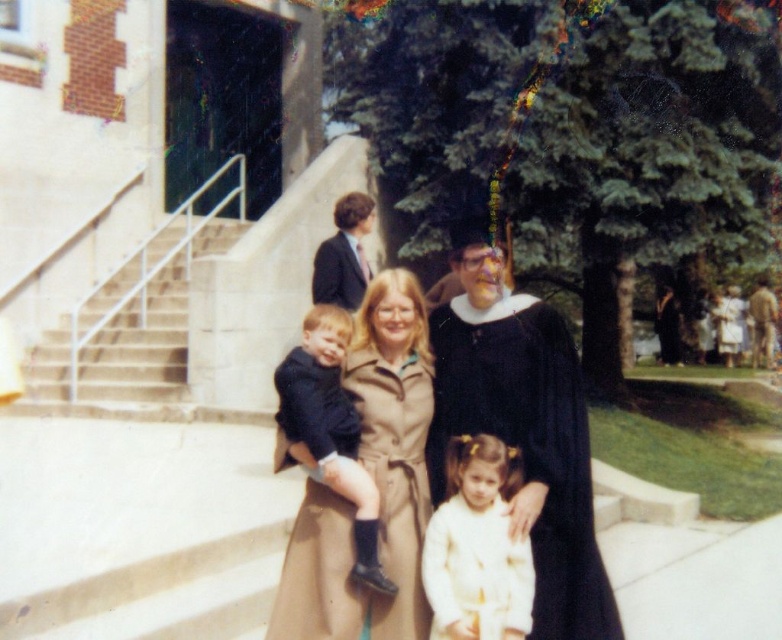
You are a photographer trying to adjust the lighting for the group photo. You notice the matte black graduation gown at center and the matte black suit at upper center. Which of these two objects is positioned higher in the image?

The matte black graduation gown at center is much taller as the matte black suit at upper center, so the graduation gown is positioned higher in the image.

You are a photographer adjusting the camera focus. The matte black graduation gown at center and the matte black suit at upper center are both in the frame. Which one requires a closer focus to capture details clearly?

The matte black graduation gown at center is larger in size than the matte black suit at upper center, so it would require a closer focus to capture details clearly since larger objects need to be closer to the camera for detailed focus.